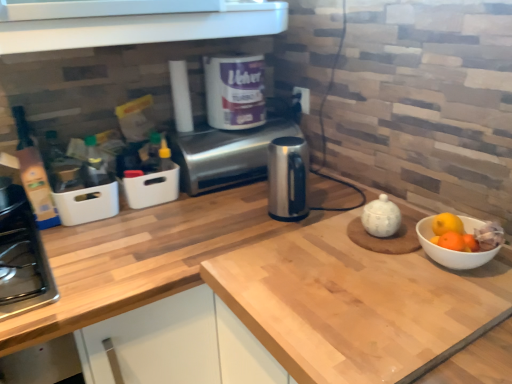
The image size is (512, 384). Find the location of `free space in front of satin silver toaster at center`. free space in front of satin silver toaster at center is located at coordinates (222, 212).